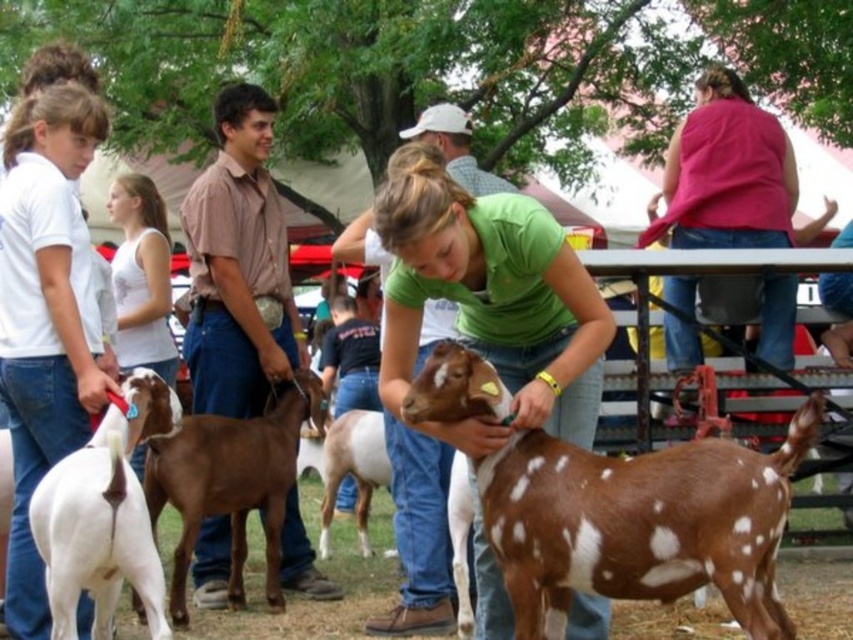
Looking at this image, which is more to the left, white matte goat at left or white speckled fur at center?

From the viewer's perspective, white matte goat at left appears more on the left side.

I want to click on white matte goat at left, so click(45, 314).

Where is `white matte goat at left`? white matte goat at left is located at coordinates (45, 314).

Consider the image. Can you confirm if white glossy goat at left is positioned to the right of white speckled fur at center?

Incorrect, white glossy goat at left is not on the right side of white speckled fur at center.

Between point (160, 396) and point (364, 524), which one is positioned behind?

Positioned behind is point (364, 524).

Does point (137, 496) come behind point (358, 416)?

That is False.

Find the location of `white glossy goat at left`. white glossy goat at left is located at coordinates (103, 516).

Is green matte shirt at center positioned in front of white speckled fur at center?

Yes, it is in front of white speckled fur at center.

Is green matte shirt at center shorter than white speckled fur at center?

In fact, green matte shirt at center may be taller than white speckled fur at center.

Who is more forward, (589, 330) or (329, 436)?

Point (589, 330)

The image size is (853, 640). In order to click on green matte shirt at center in this screenshot , I will do `click(491, 292)`.